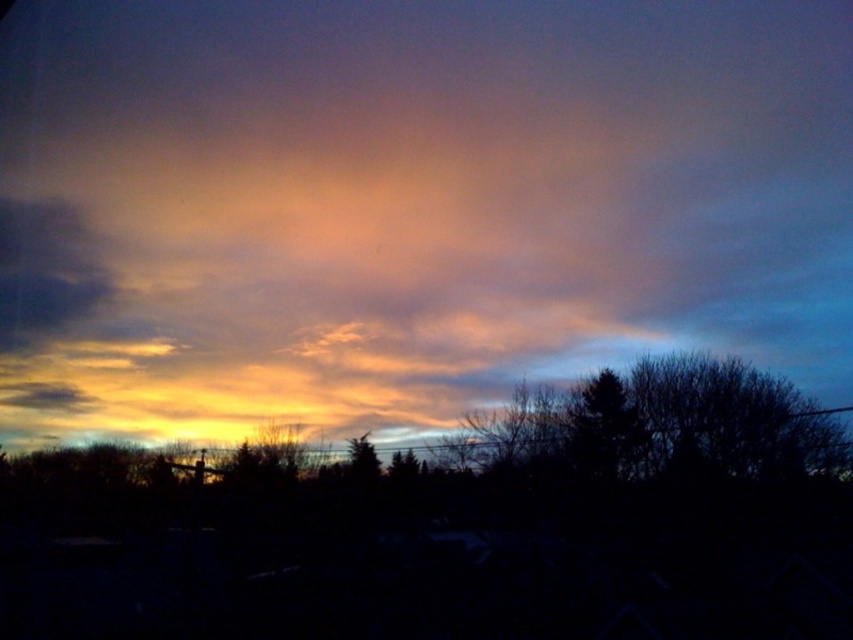
You are an artist painting the sunset scene. You want to add a mountain silhouette to the right of the silhouette bare tree at center. Will the mountain silhouette be to the left or right of the cloudy sky at upper center?

The mountain silhouette will be to the right of the cloudy sky at upper center because the cloudy sky at upper center is already to the left of the silhouette bare tree at center. Since the mountain is to the right of the tree, it will be further right than the cloudy sky.

You are an astronomer analyzing the sunset scene. You notice a point labeled at coordinates point (408, 204). Based on the scene description, what does this point most likely represent?

The point (408, 204) indicates cloudy sky at upper center, so it most likely represents the cloudy sky area at the upper center of the image.